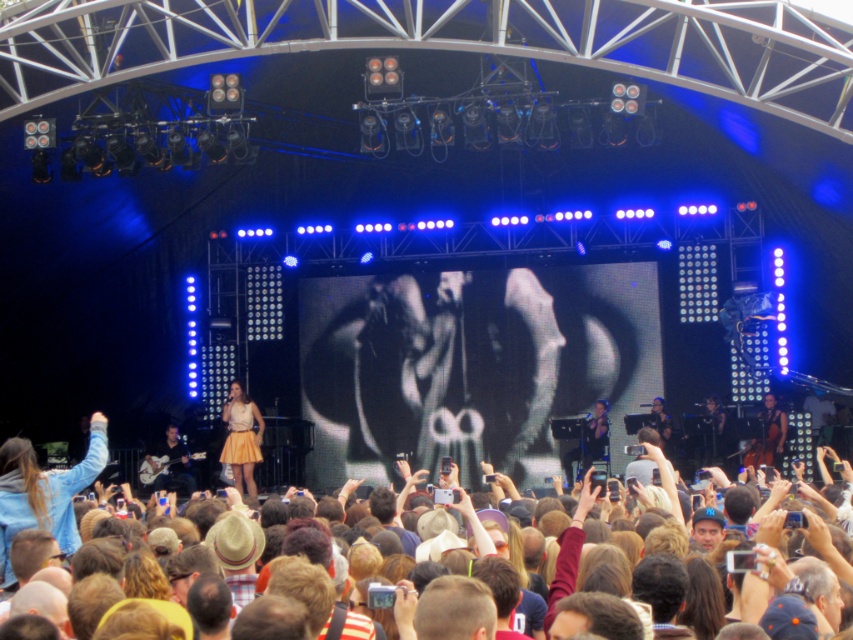
You are a photographer at the concert wanting to capture a photo of the brown hair at center and the matte black guitar at lower left. Which object should you focus on first to ensure both are in sharp focus?

The brown hair at center is closer to the viewer than the matte black guitar at lower left, so you should focus on the brown hair at center first to ensure both are in sharp focus.

You are a photographer at the concert and want to take a photo of the yellow textured skirt at center and the dark blue fabric at center. Which object will appear larger in the photo?

The yellow textured skirt at center will appear larger in the photo because it is closer to the viewer than the dark blue fabric at center.

You are a photographer at the concert standing at the center of the stage. You want to take a photo that includes both the yellow textured skirt at center and the dark blue fabric at center. Given that your camera has a maximum focus range of 35 meters, will you be able to capture both objects in focus?

The yellow textured skirt at center is 34.93 meters away from the dark blue fabric at center. Since the maximum focus range is 35 meters, the distance between them is within the camera limit. Therefore, both objects can be captured in focus.